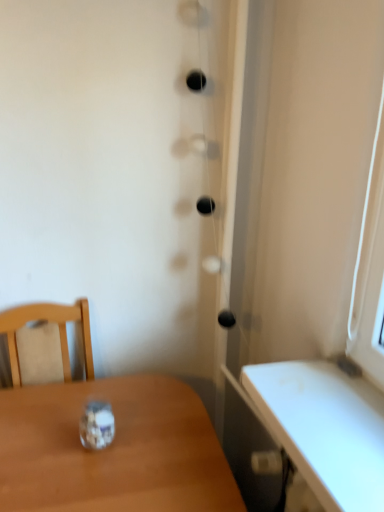
Find the location of `blank space situated above wooden table at lower left (from a real-world perspective)`. blank space situated above wooden table at lower left (from a real-world perspective) is located at coordinates (105, 444).